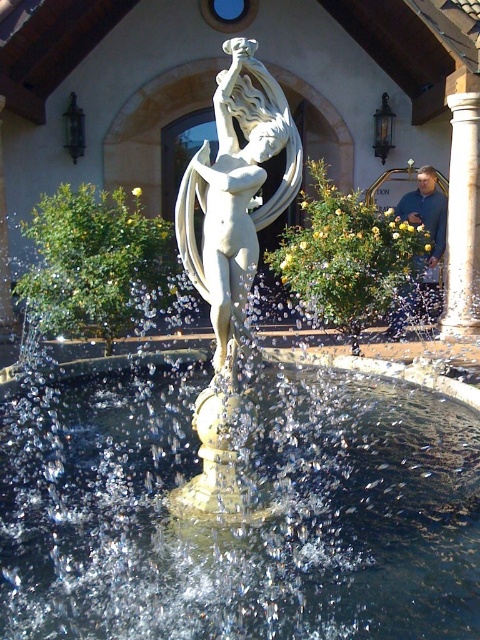
Question: Which point is farther from the camera taking this photo?

Choices:
 (A) (466, 269)
 (B) (325, 529)
 (C) (285, 145)

Answer: (A)

Question: Which of these objects is positioned closest to the clear water at center?

Choices:
 (A) white marble statue at center
 (B) white marble pillar at right

Answer: (A)

Question: Among these points, which one is nearest to the camera?

Choices:
 (A) (451, 269)
 (B) (271, 200)
 (C) (443, 582)

Answer: (C)

Question: Is clear water at center wider than white marble statue at center?

Choices:
 (A) yes
 (B) no

Answer: (A)

Question: From the image, what is the correct spatial relationship of white marble statue at center in relation to white marble pillar at right?

Choices:
 (A) right
 (B) left

Answer: (B)

Question: In this image, where is clear water at center located relative to white marble statue at center?

Choices:
 (A) right
 (B) left

Answer: (B)